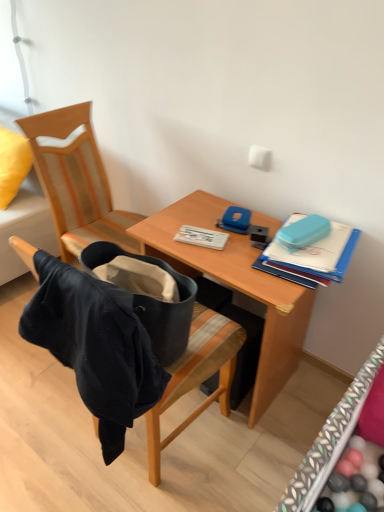
What are the coordinates of `vacant location behind white plastic notebook at center` in the screenshot? It's located at (201, 211).